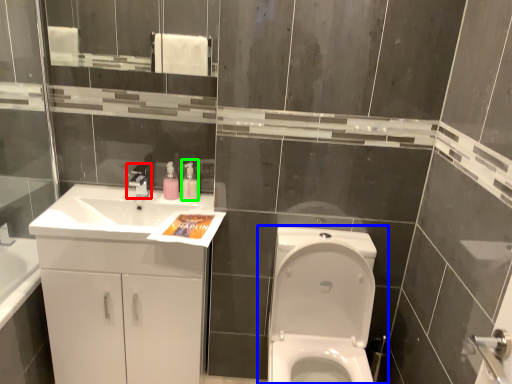
Question: Estimate the real-world distances between objects in this image. Which object is farther from tap (highlighted by a red box), toilet (highlighted by a blue box) or soap dispenser (highlighted by a green box)?

Choices:
 (A) toilet
 (B) soap dispenser

Answer: (A)